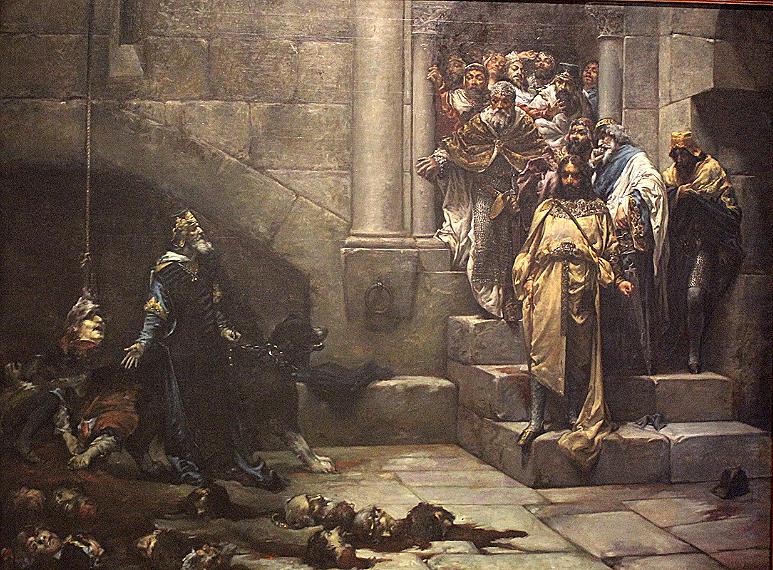
Find the location of a particular element. This screenshot has width=773, height=570. doorway is located at coordinates (516, 31).